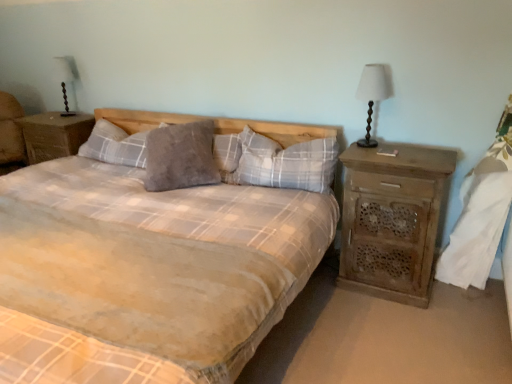
Find the location of a particular element. The height and width of the screenshot is (384, 512). vacant space situated on the left part of rustic wood nightstand at right, the first nightstand when ordered from right to left is located at coordinates (328, 309).